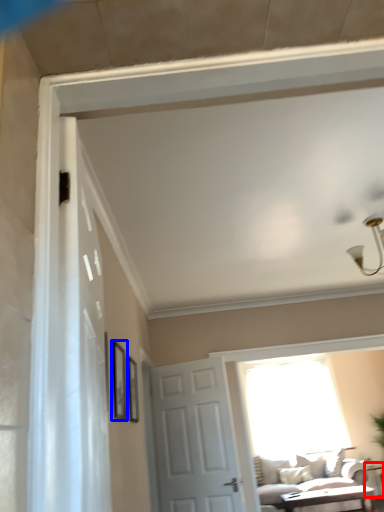
Question: Which of the following is the farthest to the observer, table (highlighted by a red box) or picture frame (highlighted by a blue box)?

Choices:
 (A) table
 (B) picture frame

Answer: (A)